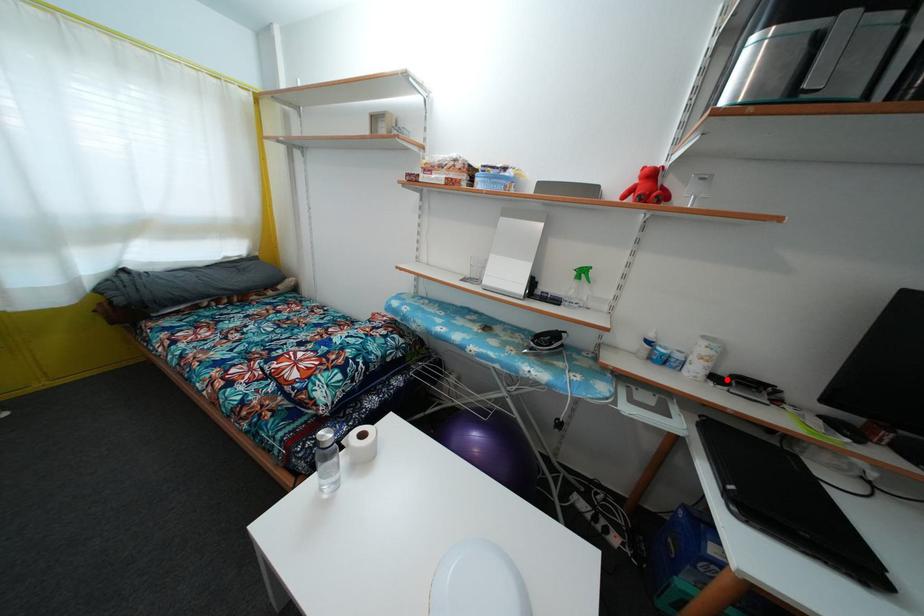
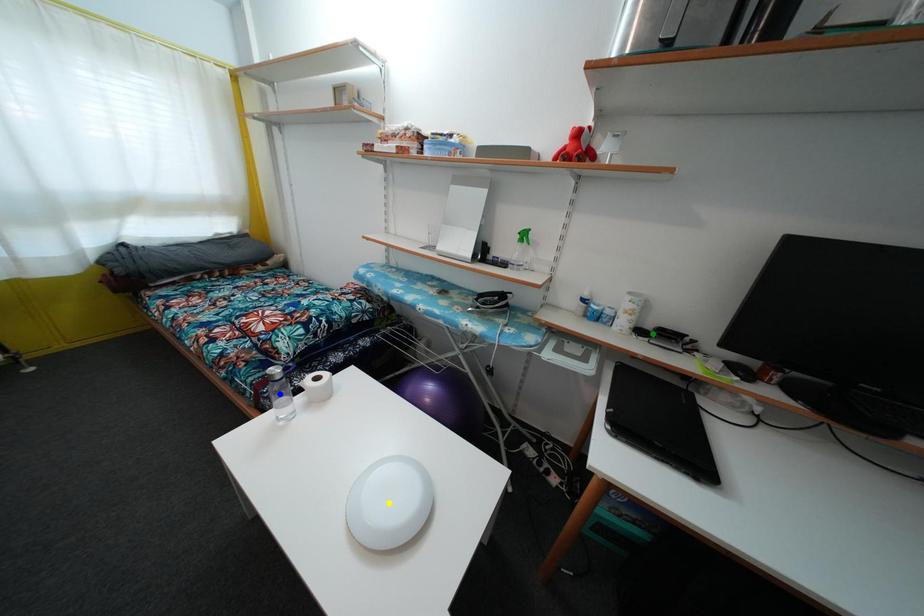
Question: I am providing you with two images of the same scene from different viewpoints. A red point is marked on the first image. You are given multiple points on the second image. Which spot in image 2 lines up with the point in image 1?

Choices:
 (A) green point
 (B) blue point
 (C) yellow point

Answer: (A)